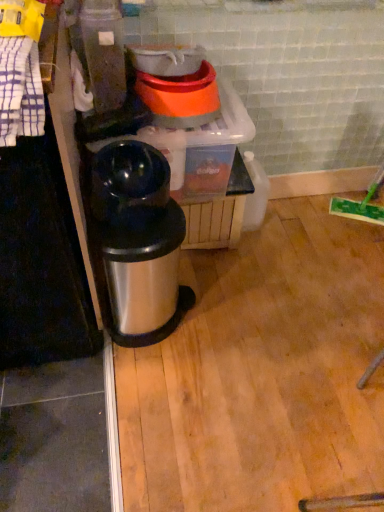
At what (x,y) coordinates should I click in order to perform the action: click on vacant region in front of shiny metallic trash can at center. Please return your answer as a coordinate pair (x, y). Looking at the image, I should click on (140, 384).